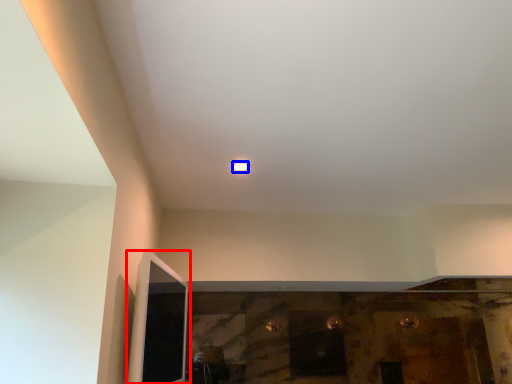
Question: Which object appears farthest to the camera in this image, screen door (highlighted by a red box) or light (highlighted by a blue box)?

Choices:
 (A) screen door
 (B) light

Answer: (B)